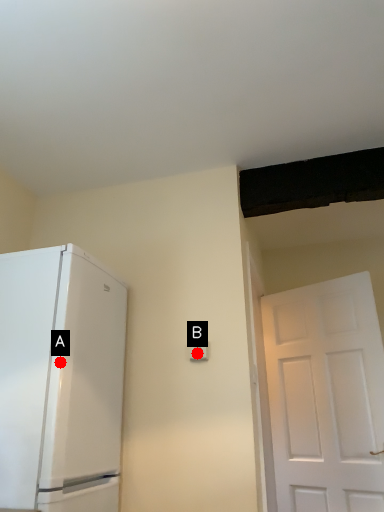
Question: Two points are circled on the image, labeled by A and B beside each circle. Which of the following is the farthest from the observer?

Choices:
 (A) A is further
 (B) B is further

Answer: (B)